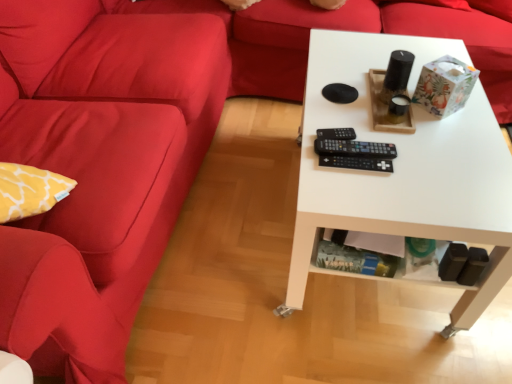
Locate an element on the screen. The height and width of the screenshot is (384, 512). free space to the right of black plastic remote at center, acting as the 1th control starting from the top is located at coordinates (395, 136).